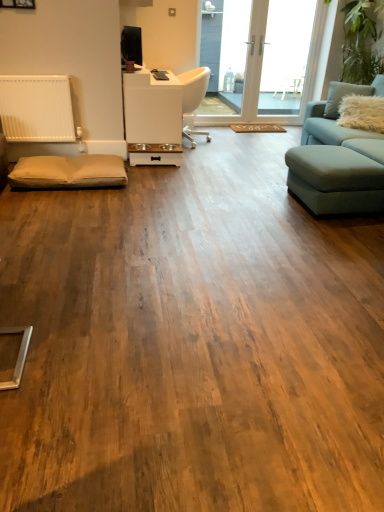
Where is `spots to the right of beige fabric footrest at lower left`? spots to the right of beige fabric footrest at lower left is located at coordinates (x=165, y=192).